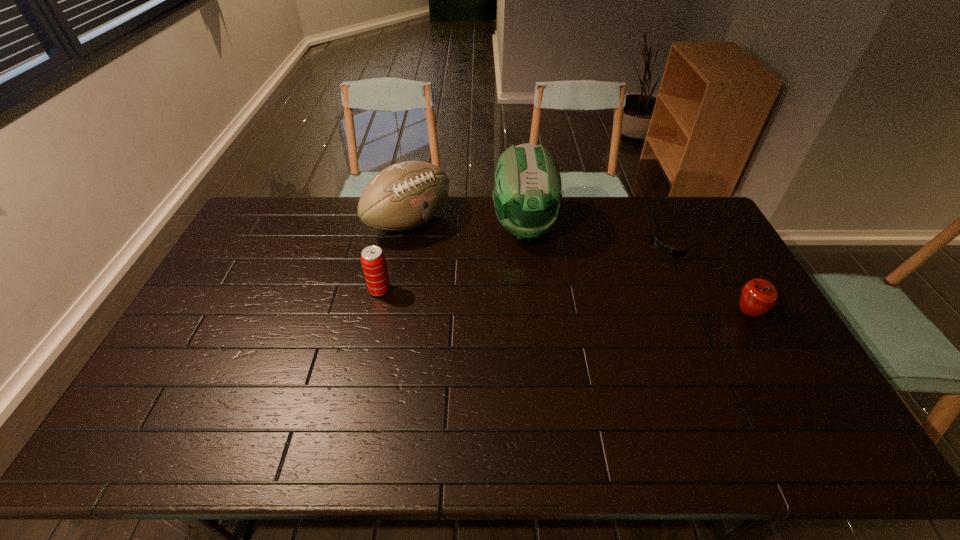
The image size is (960, 540). In order to click on free space located 0.080m on the visor of the football helmet in this screenshot , I will do `click(532, 271)`.

Identify the location of vacant point located on the visor of the football helmet. Image resolution: width=960 pixels, height=540 pixels. (544, 343).

Find the location of `vacant space located on the visor of the football helmet`. vacant space located on the visor of the football helmet is located at coordinates (534, 285).

Find the location of `vacant point located on the front-facing side of the sunglasses`. vacant point located on the front-facing side of the sunglasses is located at coordinates (596, 301).

You are a GUI agent. You are given a task and a screenshot of the screen. Output one action in this format:
    pyautogui.click(x=<x>, y=<y>)
    Task: Click on the vacant space positioned on the front-facing side of the sunglasses
    
    Given the screenshot: What is the action you would take?
    [630, 276]

Image resolution: width=960 pixels, height=540 pixels. Find the location of `vacant space located 0.240m on the front-facing side of the sunglasses`. vacant space located 0.240m on the front-facing side of the sunglasses is located at coordinates (616, 286).

I want to click on vacant region located on the laces of the fourth shortest object, so click(449, 248).

Image resolution: width=960 pixels, height=540 pixels. What are the coordinates of `free space located on the laces of the fourth shortest object` in the screenshot? It's located at (508, 288).

Where is `vacant point located on the laces of the fourth shortest object`? The image size is (960, 540). vacant point located on the laces of the fourth shortest object is located at coordinates (493, 279).

The width and height of the screenshot is (960, 540). Identify the location of football helmet that is positioned at the far edge. (x=528, y=192).